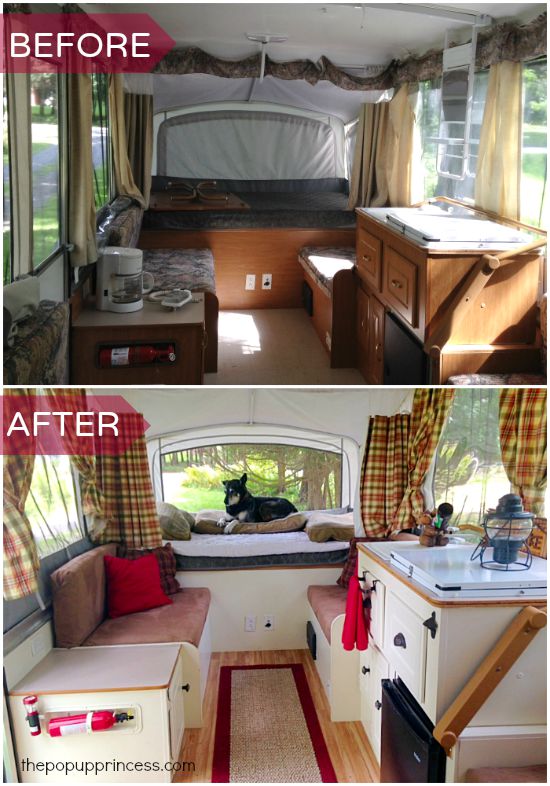
Locate an element on the screen. mat is located at coordinates (267, 725).